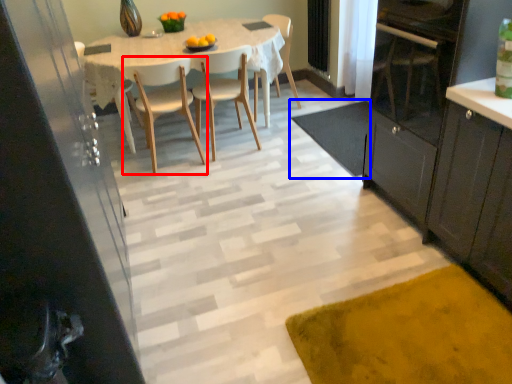
Question: Which point is further to the camera, chair (highlighted by a red box) or doormat (highlighted by a blue box)?

Choices:
 (A) chair
 (B) doormat

Answer: (B)